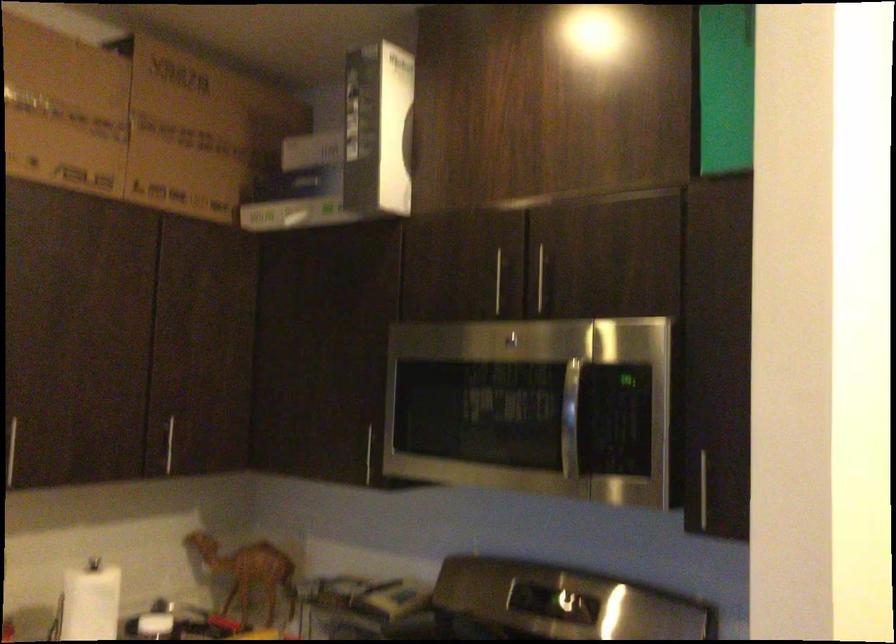
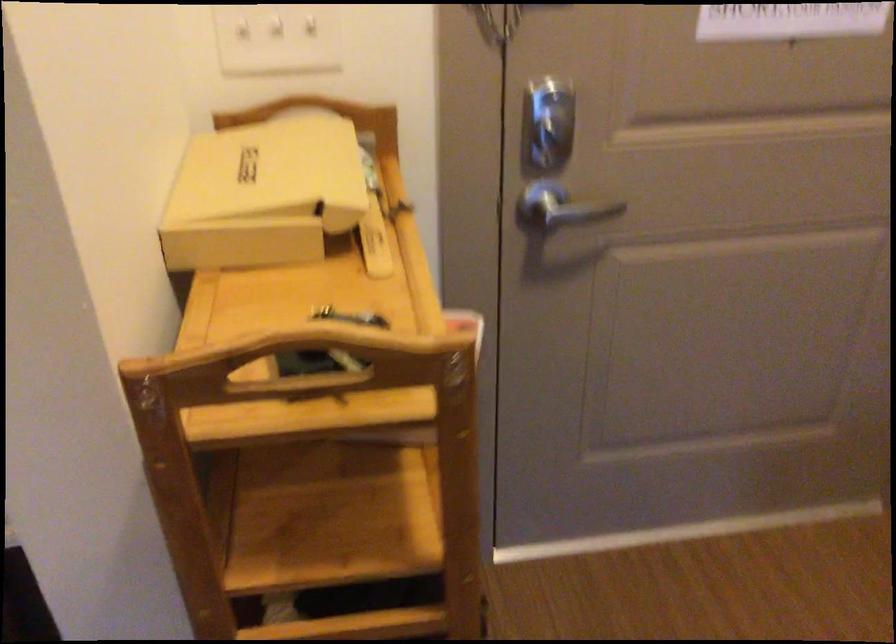
First-person continuous shooting, in which direction is the camera rotating?

The rotation direction of the camera is right-down.